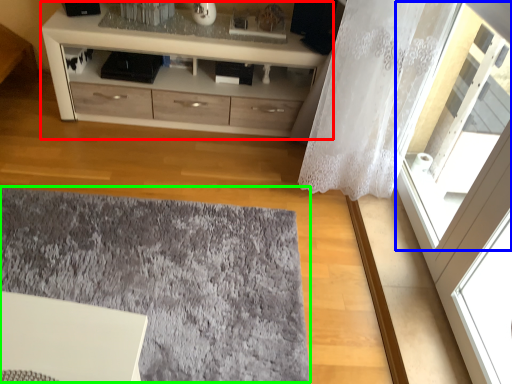
Question: Which object is positioned farthest from chest of drawers (highlighted by a red box)? Select from window (highlighted by a blue box) and mat (highlighted by a green box).

Choices:
 (A) window
 (B) mat

Answer: (B)